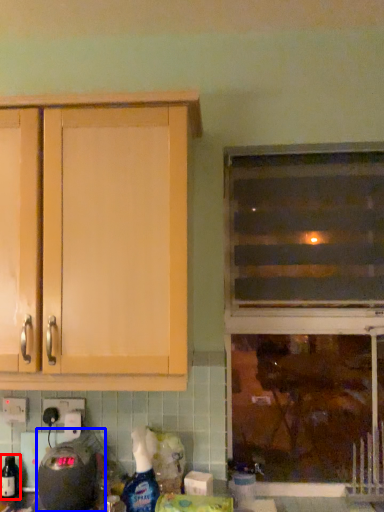
Question: Which point is closer to the camera, bottle (highlighted by a red box) or appliance (highlighted by a blue box)?

Choices:
 (A) bottle
 (B) appliance

Answer: (B)